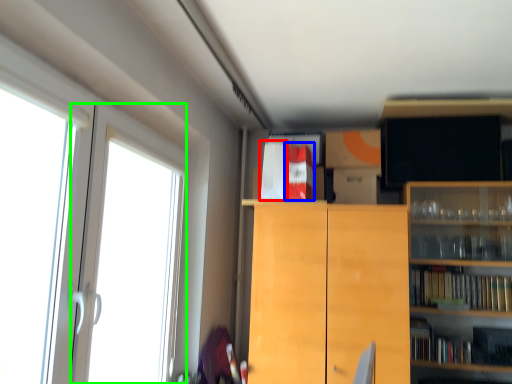
Question: Which object is positioned farthest from book (highlighted by a red box)? Select from book (highlighted by a blue box) and screen door (highlighted by a green box).

Choices:
 (A) book
 (B) screen door

Answer: (B)